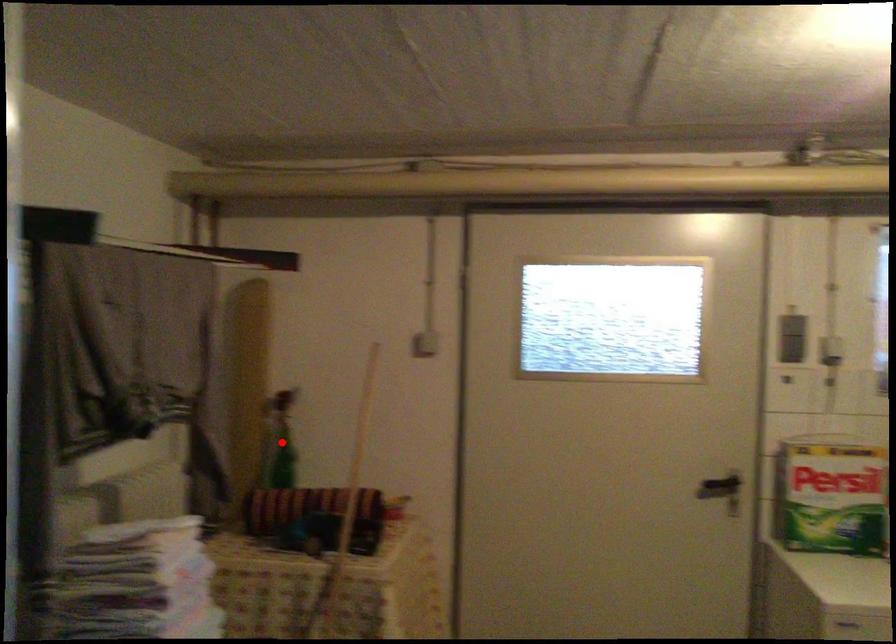
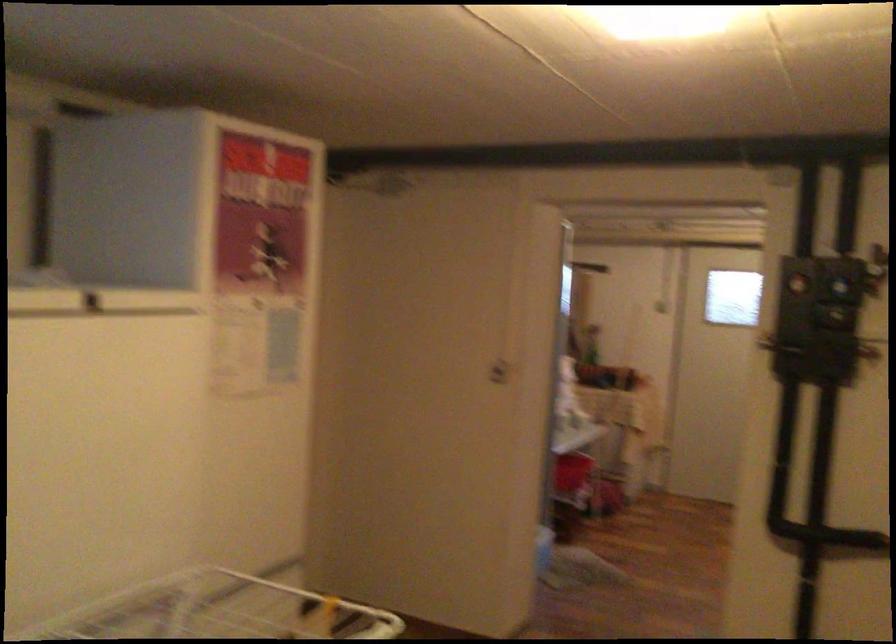
Question: I am providing you with two images of the same scene from different viewpoints. A red point is marked on the first image. Is the red point's position out of view in image 2?

Choices:
 (A) Yes
 (B) No

Answer: (A)